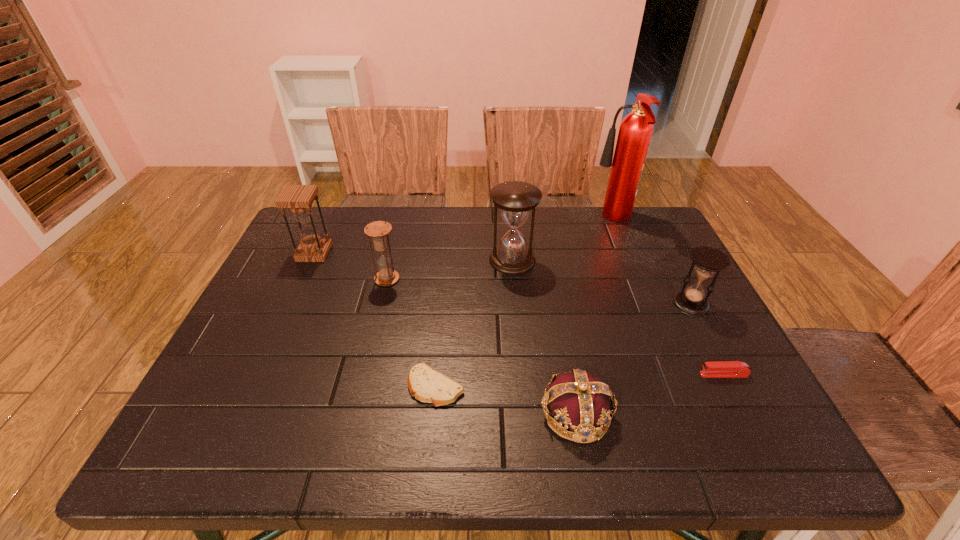
Identify the location of the farthest object. The width and height of the screenshot is (960, 540). (635, 131).

Find the location of a particular element. The width and height of the screenshot is (960, 540). fire extinguisher is located at coordinates (635, 131).

Image resolution: width=960 pixels, height=540 pixels. I want to click on the third hourglass from left to right, so click(x=516, y=199).

At what (x,y) coordinates should I click in order to perform the action: click on the leftmost object. Please return your answer as a coordinate pair (x, y). Looking at the image, I should click on (298, 198).

The height and width of the screenshot is (540, 960). Find the location of `the third hourglass from right to left`. the third hourglass from right to left is located at coordinates (378, 230).

This screenshot has height=540, width=960. In order to click on the nearest hourglass in this screenshot , I will do `click(707, 260)`.

You are a GUI agent. You are given a task and a screenshot of the screen. Output one action in this format:
    pyautogui.click(x=<x>, y=<y>)
    Task: Click on the rightmost hourglass
    The image size is (960, 540).
    Given the screenshot: What is the action you would take?
    pyautogui.click(x=707, y=260)

The image size is (960, 540). What are the coordinates of `the sixth tallest object` in the screenshot? It's located at (580, 401).

This screenshot has width=960, height=540. Identify the location of stapler. (716, 369).

You are a GUI agent. You are given a task and a screenshot of the screen. Output one action in this format:
    pyautogui.click(x=<x>, y=<y>)
    Task: Click on the third object from left to right
    The image size is (960, 540).
    Given the screenshot: What is the action you would take?
    coord(427,385)